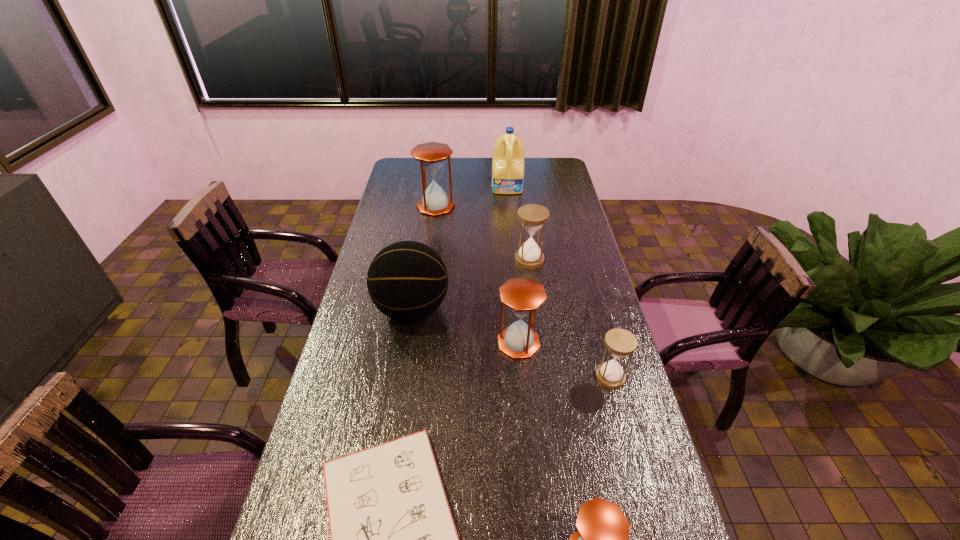
At what (x,y) coordinates should I click in order to perform the action: click on vacant space positioned on the label of the farthest object. Please return your answer as a coordinate pair (x, y). Looking at the image, I should click on (512, 224).

Find the location of a particular element. vacant space situated 0.130m on the left of the leftmost brown hourglass is located at coordinates (388, 206).

The width and height of the screenshot is (960, 540). In order to click on free point located on the right of the basketball in this screenshot , I will do `click(505, 309)`.

I want to click on vacant space located on the right of the second biggest brown hourglass, so click(x=564, y=343).

Locate an element on the screen. vacant space situated 0.090m on the left of the farther white hourglass is located at coordinates (492, 260).

This screenshot has height=540, width=960. In order to click on vacant point located on the front of the nearer white hourglass in this screenshot , I will do `click(631, 452)`.

Where is `object that is at the far edge`? object that is at the far edge is located at coordinates (508, 154).

The image size is (960, 540). In order to click on hourglass at the left edge in this screenshot , I will do `click(432, 155)`.

What are the coordinates of `basketball located at the left edge` in the screenshot? It's located at (407, 280).

Where is `object that is at the right edge`? This screenshot has width=960, height=540. object that is at the right edge is located at coordinates (620, 343).